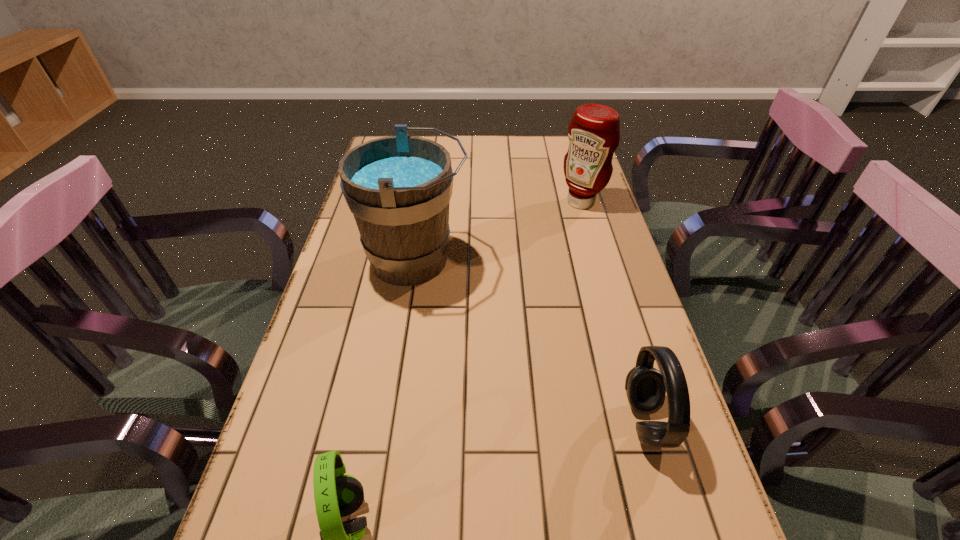
This screenshot has height=540, width=960. I want to click on condiment positioned at the right edge, so click(x=594, y=131).

Locate an element on the screen. headset situated at the right edge is located at coordinates (646, 387).

You are a GUI agent. You are given a task and a screenshot of the screen. Output one action in this format:
    pyautogui.click(x=<x>, y=<y>)
    Task: Click on the free space at the far edge
    This screenshot has width=960, height=540.
    Given the screenshot: What is the action you would take?
    pyautogui.click(x=454, y=144)

This screenshot has height=540, width=960. I want to click on vacant space at the left edge of the desktop, so click(335, 325).

In the image, there is a desktop. At what (x,y) coordinates should I click in order to perform the action: click on vacant space at the right edge. Please return your answer as a coordinate pair (x, y). The width and height of the screenshot is (960, 540). Looking at the image, I should click on (581, 297).

This screenshot has height=540, width=960. Identify the location of empty space between the condiment and the second farthest object. (498, 231).

Locate which object is the closest to the third nearest object. Please provide its 2D coordinates. Your answer should be formatted as a tuple, i.e. [(x, y)], where the tuple contains the x and y coordinates of a point satisfying the conditions above.

[(594, 131)]

Where is `object that stands as the third closest to the right headset`? object that stands as the third closest to the right headset is located at coordinates (594, 131).

The width and height of the screenshot is (960, 540). What are the coordinates of `vacant space that satisfies the following two spatial constraints: 1. on the front side of the condiment; 2. with a handle on the side of the wine bucket` in the screenshot? It's located at (598, 260).